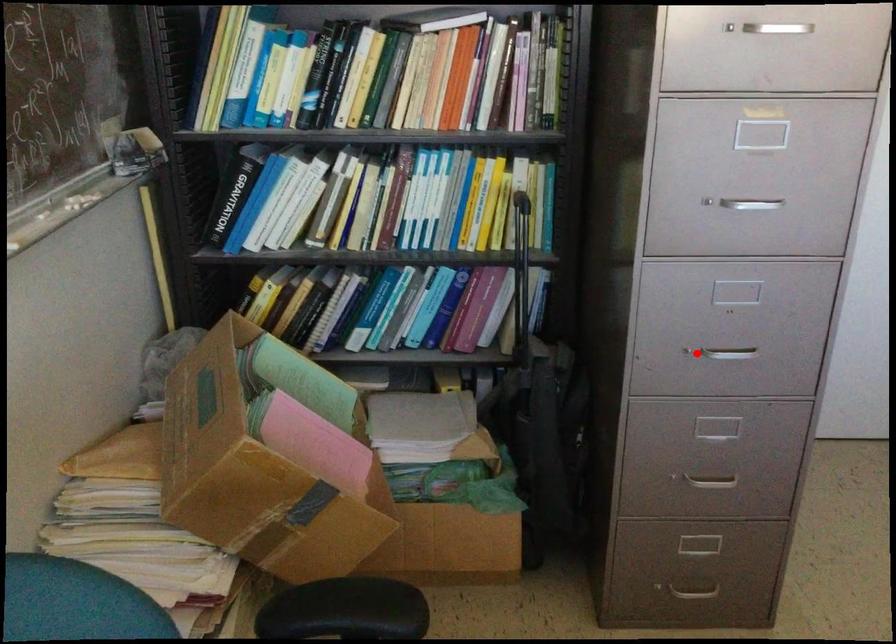
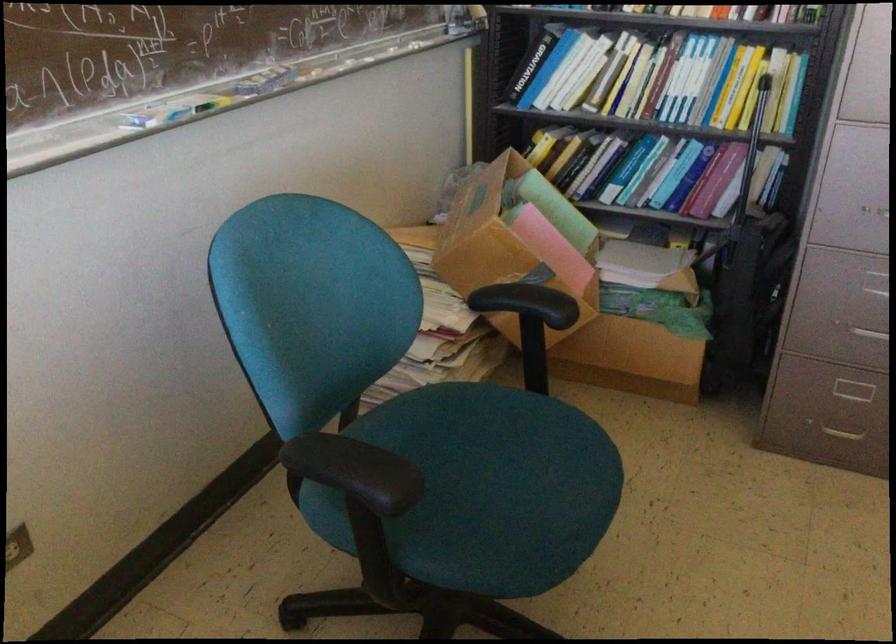
Question: I am providing you with two images of the same scene from different viewpoints. In image1, a red point is highlighted. Considering the same 3D point in image2, which of the following is correct?

Choices:
 (A) It is closer
 (B) It is farther

Answer: (B)